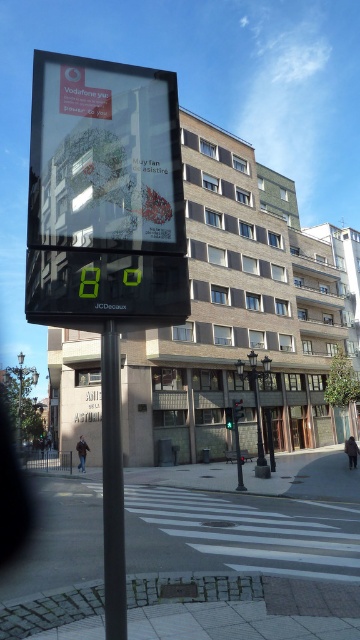
Does point (51, 64) lie behind point (117, 561)?

Yes, point (51, 64) is behind point (117, 561).

Is transparent glass billboard at center shorter than black metal pole at center?

No.

Locate an element on the screen. This screenshot has height=640, width=360. transparent glass billboard at center is located at coordinates (104, 156).

The image size is (360, 640). Identify the location of transparent glass billboard at center. (104, 156).